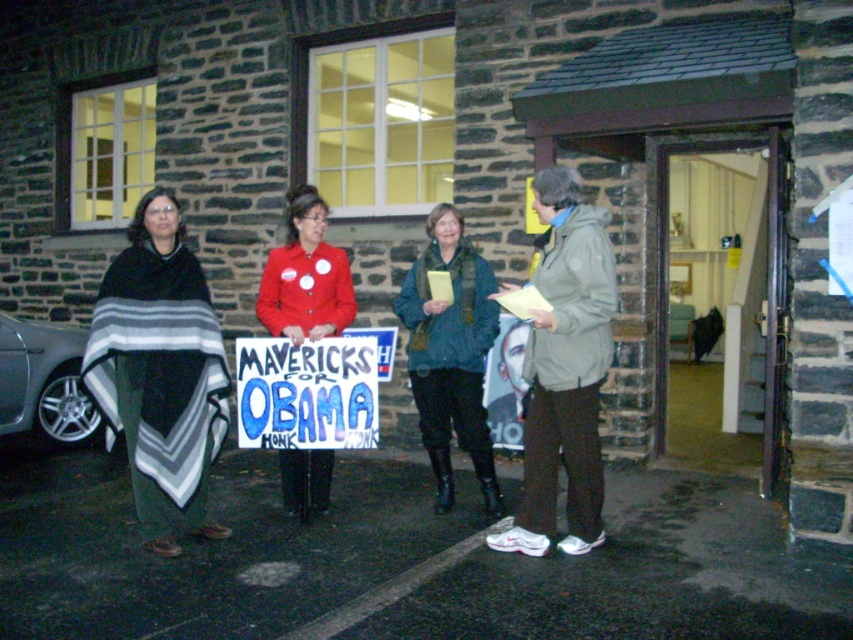
Question: Is blue painted cardboard sign at center further to the viewer compared to red matte jacket at center?

Choices:
 (A) yes
 (B) no

Answer: (B)

Question: Estimate the real-world distances between objects in this image. Which object is closer to the blue-green textured scarf at center?

Choices:
 (A) red matte jacket at center
 (B) striped wool poncho at left

Answer: (A)

Question: Which point appears closest to the camera in this image?

Choices:
 (A) (265, 358)
 (B) (413, 394)

Answer: (A)

Question: Is the position of striped wool poncho at left less distant than that of red matte jacket at center?

Choices:
 (A) yes
 (B) no

Answer: (A)

Question: Among these objects, which one is nearest to the camera?

Choices:
 (A) striped wool poncho at left
 (B) red matte jacket at center
 (C) blue painted cardboard sign at center
 (D) blue-green textured scarf at center

Answer: (A)

Question: Observing the image, what is the correct spatial positioning of striped wool poncho at left in reference to blue-green textured scarf at center?

Choices:
 (A) left
 (B) right

Answer: (A)